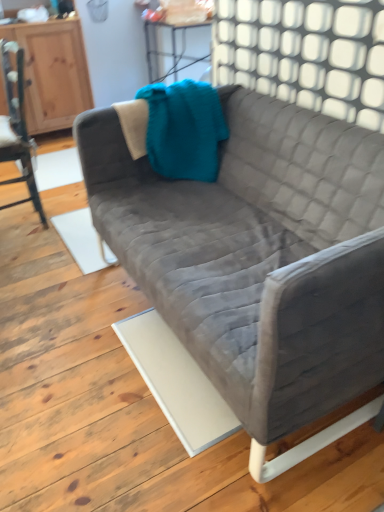
Locate an element on the screen. Image resolution: width=384 pixels, height=512 pixels. velvet gray couch at center is located at coordinates (258, 260).

Measure the distance between point (29, 157) and camera.

Point (29, 157) is 1.99 meters from camera.

Locate an element on the screen. wooden dresser at left is located at coordinates (52, 72).

The image size is (384, 512). I want to click on velvet gray couch at center, so click(x=258, y=260).

Based on their sizes in the image, would you say wooden dresser at left is bigger or smaller than wooden chair at left?

In the image, wooden dresser at left appears to be larger than wooden chair at left.

Considering the relative positions of wooden dresser at left and wooden chair at left in the image provided, is wooden dresser at left behind wooden chair at left?

Yes, the depth of wooden dresser at left is greater than that of wooden chair at left.

Is wooden dresser at left aimed at wooden chair at left?

Yes, wooden dresser at left is oriented towards wooden chair at left.

Could you tell me if white textured wall at upper center is turned towards wooden chair at left?

No.

From a real-world perspective, relative to wooden chair at left, is white textured wall at upper center vertically above or below?

In terms of real-world spatial position, white textured wall at upper center is above wooden chair at left.

Is white textured wall at upper center to the right of wooden chair at left from the viewer's perspective?

Correct, you'll find white textured wall at upper center to the right of wooden chair at left.

Is velvet gray couch at center at the right side of wooden dresser at left?

Correct, you'll find velvet gray couch at center to the right of wooden dresser at left.

Is velvet gray couch at center wider than wooden dresser at left?

Correct, the width of velvet gray couch at center exceeds that of wooden dresser at left.

Considering the relative sizes of velvet gray couch at center and wooden dresser at left in the image provided, is velvet gray couch at center smaller than wooden dresser at left?

Incorrect, velvet gray couch at center is not smaller in size than wooden dresser at left.

Is velvet gray couch at center outside of wooden dresser at left?

Absolutely, velvet gray couch at center is external to wooden dresser at left.

In the scene shown: Which object is further away from the camera, velvet gray couch at center or white textured wall at upper center?

white textured wall at upper center.

Is velvet gray couch at center facing away from white textured wall at upper center?

No, velvet gray couch at center is not facing the opposite direction of white textured wall at upper center.

Measure the distance from velvet gray couch at center to white textured wall at upper center.

velvet gray couch at center is 17.19 inches from white textured wall at upper center.

What's the angular difference between velvet gray couch at center and white textured wall at upper center's facing directions?

They differ by 180 degrees in their facing directions.

How far apart are wooden dresser at left and white textured wall at upper center?

The distance of wooden dresser at left from white textured wall at upper center is 1.85 meters.

Is wooden dresser at left thinner than white textured wall at upper center?

Incorrect, the width of wooden dresser at left is not less than that of white textured wall at upper center.

Is point (57, 23) behind point (381, 101)?

That is True.

In terms of size, does wooden chair at left appear bigger or smaller than white textured wall at upper center?

In the image, wooden chair at left appears to be larger than white textured wall at upper center.

Is there a large distance between wooden chair at left and white textured wall at upper center?

wooden chair at left is far away from white textured wall at upper center.

Is wooden chair at left inside the boundaries of white textured wall at upper center, or outside?

wooden chair at left is not inside white textured wall at upper center, it's outside.

From the image's perspective, is wooden chair at left above or below white textured wall at upper center?

From the image's perspective, wooden chair at left appears below white textured wall at upper center.

How many degrees apart are the facing directions of wooden chair at left and velvet gray couch at center?

wooden chair at left and velvet gray couch at center are facing 0.834 degrees away from each other.

Where is `studio couch below the wooden chair at left (from the image's perspective)`? This screenshot has width=384, height=512. studio couch below the wooden chair at left (from the image's perspective) is located at coordinates (258, 260).

From the image's perspective, is wooden chair at left above or below velvet gray couch at center?

wooden chair at left is above velvet gray couch at center.

Is wooden chair at left turned away from velvet gray couch at center?

wooden chair at left is not turned away from velvet gray couch at center.

Find the location of `dresser that is above the wooden chair at left (from a real-world perspective)`. dresser that is above the wooden chair at left (from a real-world perspective) is located at coordinates (52, 72).

Image resolution: width=384 pixels, height=512 pixels. I want to click on chair below the white textured wall at upper center (from the image's perspective), so coord(17,127).

When comparing their distances from wooden dresser at left, does wooden chair at left or velvet gray couch at center seem further?

velvet gray couch at center lies further to wooden dresser at left than the other object.

Estimate the real-world distances between objects in this image. Which object is further from wooden dresser at left, white textured wall at upper center or wooden chair at left?

Based on the image, white textured wall at upper center appears to be further to wooden dresser at left.

Estimate the real-world distances between objects in this image. Which object is closer to wooden dresser at left, velvet gray couch at center or white textured wall at upper center?

Based on the image, white textured wall at upper center appears to be nearer to wooden dresser at left.

From the image, which object appears to be farther from velvet gray couch at center, white textured wall at upper center or wooden dresser at left?

Among the two, wooden dresser at left is located further to velvet gray couch at center.

Which object lies nearer to the anchor point velvet gray couch at center, wooden chair at left or wooden dresser at left?

The object closer to velvet gray couch at center is wooden chair at left.

Estimate the real-world distances between objects in this image. Which object is closer to velvet gray couch at center, wooden dresser at left or white textured wall at upper center?

white textured wall at upper center is closer to velvet gray couch at center.

Considering their positions, is wooden dresser at left positioned further to white textured wall at upper center than wooden chair at left?

The object further to white textured wall at upper center is wooden dresser at left.

When comparing their distances from white textured wall at upper center, does wooden chair at left or wooden dresser at left seem closer?

wooden chair at left is positioned closer to the anchor white textured wall at upper center.

You are a GUI agent. You are given a task and a screenshot of the screen. Output one action in this format:
    pyautogui.click(x=<x>, y=<y>)
    Task: Click on the chair between velvet gray couch at center and wooden dresser at left in the front-back direction
    This screenshot has width=384, height=512.
    Given the screenshot: What is the action you would take?
    pyautogui.click(x=17, y=127)

Where is `studio couch between wooden chair at left and white textured wall at upper center from left to right`? studio couch between wooden chair at left and white textured wall at upper center from left to right is located at coordinates (258, 260).

Find the location of a particular element. The height and width of the screenshot is (512, 384). window located between velvet gray couch at center and wooden dresser at left in the depth direction is located at coordinates (305, 54).

What are the coordinates of `chair situated between wooden dresser at left and white textured wall at upper center from left to right` in the screenshot? It's located at (17, 127).